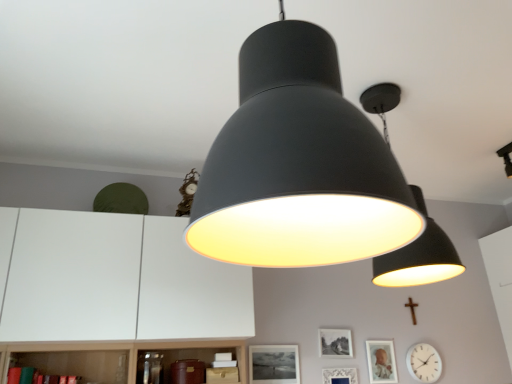
How much space does matte silver picture frame at lower right, the fourth picture frame positioned from the left, occupy vertically?

matte silver picture frame at lower right, the fourth picture frame positioned from the left, is 10.72 inches tall.

Describe the element at coordinates (381, 361) in the screenshot. I see `matte silver picture frame at lower right, the fourth picture frame positioned from the left` at that location.

This screenshot has width=512, height=384. Find the location of `matte black lampshade at center, which appears as the 2th lamp when viewed from the back`. matte black lampshade at center, which appears as the 2th lamp when viewed from the back is located at coordinates (298, 165).

What's the angular difference between matte black lampshade at center, the 1th lamp from the front, and black matte picture frame at center, which is the 4th picture frame from right to left,'s facing directions?

The angular difference between matte black lampshade at center, the 1th lamp from the front, and black matte picture frame at center, which is the 4th picture frame from right to left, is 1.17 degrees.

Is matte black lampshade at center, which appears as the 2th lamp when viewed from the back, facing towards black matte picture frame at center, which ranks as the 1th picture frame in left-to-right order?

No, matte black lampshade at center, which appears as the 2th lamp when viewed from the back, is not aimed at black matte picture frame at center, which ranks as the 1th picture frame in left-to-right order.

Can we say matte black lampshade at center, which appears as the 2th lamp when viewed from the back, lies outside black matte picture frame at center, which ranks as the 1th picture frame in left-to-right order?

Indeed, matte black lampshade at center, which appears as the 2th lamp when viewed from the back, is completely outside black matte picture frame at center, which ranks as the 1th picture frame in left-to-right order.

Is white glossy clock at lower right smaller than black matte picture frame at center, which is the 4th picture frame from right to left?

→ No, white glossy clock at lower right is not smaller than black matte picture frame at center, which is the 4th picture frame from right to left.

In the scene shown: Considering the sizes of white glossy clock at lower right and black matte picture frame at center, which is the 4th picture frame from right to left, in the image, is white glossy clock at lower right taller or shorter than black matte picture frame at center, which is the 4th picture frame from right to left,?

white glossy clock at lower right is taller than black matte picture frame at center, which is the 4th picture frame from right to left.

Is white glossy clock at lower right facing towards black matte picture frame at center, which is the 4th picture frame from right to left?

No, white glossy clock at lower right is not aimed at black matte picture frame at center, which is the 4th picture frame from right to left.

From the image's perspective, is white glossy clock at lower right over black matte picture frame at center, which ranks as the 1th picture frame in left-to-right order?

Actually, white glossy clock at lower right appears below black matte picture frame at center, which ranks as the 1th picture frame in left-to-right order, in the image.

Which of these two, matte silver picture frame at lower right, the fourth picture frame positioned from the left, or matte black lampshade at center, which ranks as the second lamp in right-to-left order, stands shorter?

matte silver picture frame at lower right, the fourth picture frame positioned from the left.

From the image's perspective, is matte silver picture frame at lower right, the 1th picture frame from the right, beneath matte black lampshade at center, which ranks as the second lamp in right-to-left order?

Correct, matte silver picture frame at lower right, the 1th picture frame from the right, appears lower than matte black lampshade at center, which ranks as the second lamp in right-to-left order, in the image.

Is matte silver picture frame at lower right, the fourth picture frame positioned from the left, situated inside matte black lampshade at center, which appears as the 2th lamp when viewed from the back, or outside?

matte silver picture frame at lower right, the fourth picture frame positioned from the left, is not inside matte black lampshade at center, which appears as the 2th lamp when viewed from the back, it's outside.

Would you consider matte silver picture frame at lower right, the 1th picture frame from the right, to be distant from matte black lampshade at center, the 1th lamp from the front?

matte silver picture frame at lower right, the 1th picture frame from the right, is positioned a significant distance from matte black lampshade at center, the 1th lamp from the front.

From a real-world perspective, starting from the white glossy clock at lower right, which lamp is the 1st one vertically above it? Please provide its 2D coordinates.

[(298, 165)]

Is white glossy clock at lower right positioned before matte black lampshade at center, which appears as the 2th lamp when viewed from the back?

That is False.

Considering the points (413, 365) and (374, 244), which point is behind, point (413, 365) or point (374, 244)?

The point (413, 365) is farther.

Between white glossy clock at lower right and matte black lampshade at center, which ranks as the second lamp in right-to-left order, which one has more height?

Standing taller between the two is matte black lampshade at center, which ranks as the second lamp in right-to-left order.

Between matte silver picture frame at lower right, the 1th picture frame from the right, and matte black picture frame at center, arranged as the 3th picture frame when viewed from the right, which one appears on the left side from the viewer's perspective?

matte black picture frame at center, arranged as the 3th picture frame when viewed from the right, is more to the left.

Is the position of matte silver picture frame at lower right, the fourth picture frame positioned from the left, more distant than that of matte black picture frame at center, the 2th picture frame from the left?

Yes, the depth of matte silver picture frame at lower right, the fourth picture frame positioned from the left, is greater than that of matte black picture frame at center, the 2th picture frame from the left.

Looking at the image, does matte silver picture frame at lower right, the fourth picture frame positioned from the left, seem bigger or smaller compared to matte black picture frame at center, the 2th picture frame from the left?

Clearly, matte silver picture frame at lower right, the fourth picture frame positioned from the left, is smaller in size than matte black picture frame at center, the 2th picture frame from the left.

Would you say matte silver picture frame at lower right, the 1th picture frame from the right, is outside matte black picture frame at center, arranged as the 3th picture frame when viewed from the right?

Yes, matte silver picture frame at lower right, the 1th picture frame from the right, is not within matte black picture frame at center, arranged as the 3th picture frame when viewed from the right.

Do you think matte black picture frame at center, arranged as the 3th picture frame when viewed from the right, is within white glossy clock at lower right, or outside of it?

matte black picture frame at center, arranged as the 3th picture frame when viewed from the right, cannot be found inside white glossy clock at lower right.

Which is in front, point (351, 353) or point (434, 378)?

The point (351, 353) is closer.

Does matte black picture frame at center, arranged as the 3th picture frame when viewed from the right, have a smaller size compared to white glossy clock at lower right?

Correct, matte black picture frame at center, arranged as the 3th picture frame when viewed from the right, occupies less space than white glossy clock at lower right.

At what (x,y) coordinates should I click in order to perform the action: click on the 2nd picture frame in front of the wooden cross at lower right. Please return your answer as a coordinate pair (x, y). The width and height of the screenshot is (512, 384). Looking at the image, I should click on (335, 343).

Is wooden cross at lower right oriented towards matte black picture frame at center, arranged as the 3th picture frame when viewed from the right?

No, wooden cross at lower right is not turned towards matte black picture frame at center, arranged as the 3th picture frame when viewed from the right.

Does wooden cross at lower right have a lesser height compared to matte black picture frame at center, arranged as the 3th picture frame when viewed from the right?

No, wooden cross at lower right is not shorter than matte black picture frame at center, arranged as the 3th picture frame when viewed from the right.

Which of these two, wooden cross at lower right or matte black picture frame at center, the 2th picture frame from the left, is bigger?

matte black picture frame at center, the 2th picture frame from the left.

At what (x,y) coordinates should I click in order to perform the action: click on the 2nd picture frame below the matte black lampshade at center, which ranks as the second lamp in right-to-left order (from the image's perspective). Please return your answer as a coordinate pair (x, y). Looking at the image, I should click on pos(274,364).

From a real-world perspective, count 2nd picture frames upward from the white glossy clock at lower right and point to it. Please provide its 2D coordinates.

[(274, 364)]

From the picture: Considering their positions, is matte black picture frame at center, the 2th picture frame from the left, positioned closer to black matte picture frame at center, which is the 4th picture frame from right to left, than wooden cross at lower right?

matte black picture frame at center, the 2th picture frame from the left, is positioned closer to the anchor black matte picture frame at center, which is the 4th picture frame from right to left.

When comparing their distances from black matte picture frame at center, which ranks as the 1th picture frame in left-to-right order, does matte black lampshade at center, the 1th lamp from the front, or white glossy clock at lower right seem further?

matte black lampshade at center, the 1th lamp from the front, is positioned further to the anchor black matte picture frame at center, which ranks as the 1th picture frame in left-to-right order.

When comparing their distances from matte black lampshade at upper center, which appears as the 2th lamp when viewed from the left, does white glossy clock at lower right or wooden cross at lower right seem closer?

white glossy clock at lower right is positioned closer to the anchor matte black lampshade at upper center, which appears as the 2th lamp when viewed from the left.

When comparing their distances from wooden cross at lower right, does white glossy clock at lower right or white matte dresser at lower left seem closer?

white glossy clock at lower right is positioned closer to the anchor wooden cross at lower right.

From the image, which object appears to be farther from white glossy clock at lower right, matte black lampshade at upper center, the 2th lamp viewed from the front, or matte black lampshade at center, which ranks as the second lamp in right-to-left order?

Based on the image, matte black lampshade at center, which ranks as the second lamp in right-to-left order, appears to be further to white glossy clock at lower right.

From the image, which object appears to be farther from matte black picture frame at center, the 2th picture frame from the left, matte silver picture frame at lower right, the fourth picture frame positioned from the left, or black matte picture frame at center, which ranks as the 1th picture frame in left-to-right order?

black matte picture frame at center, which ranks as the 1th picture frame in left-to-right order.

Looking at the image, which one is located closer to white glossy clock at lower right, matte white picture frame at center, the 3th picture frame viewed from the left, or matte black lampshade at center, which ranks as the second lamp in right-to-left order?

matte white picture frame at center, the 3th picture frame viewed from the left, lies closer to white glossy clock at lower right than the other object.

Which object lies nearer to the anchor point matte white picture frame at center, the 3th picture frame viewed from the left, black matte picture frame at center, which ranks as the 1th picture frame in left-to-right order, or wooden cross at lower right?

The object closer to matte white picture frame at center, the 3th picture frame viewed from the left, is black matte picture frame at center, which ranks as the 1th picture frame in left-to-right order.

You are a GUI agent. You are given a task and a screenshot of the screen. Output one action in this format:
    pyautogui.click(x=<x>, y=<y>)
    Task: Click on the picture frame situated between white matte dresser at lower left and matte black picture frame at center, the 2th picture frame from the left, from left to right
    The width and height of the screenshot is (512, 384).
    Given the screenshot: What is the action you would take?
    pyautogui.click(x=274, y=364)

Find the location of a particular element. This screenshot has width=512, height=384. picture frame between matte black lampshade at upper center, the 2th lamp viewed from the front, and black matte picture frame at center, which is the 4th picture frame from right to left, vertically is located at coordinates click(x=335, y=343).

Where is `crucifix situated between matte black picture frame at center, the 2th picture frame from the left, and white glossy clock at lower right from left to right`? This screenshot has height=384, width=512. crucifix situated between matte black picture frame at center, the 2th picture frame from the left, and white glossy clock at lower right from left to right is located at coordinates (412, 309).

This screenshot has width=512, height=384. Find the location of `picture frame between matte black picture frame at center, the 2th picture frame from the left, and matte silver picture frame at lower right, the fourth picture frame positioned from the left, in the horizontal direction`. picture frame between matte black picture frame at center, the 2th picture frame from the left, and matte silver picture frame at lower right, the fourth picture frame positioned from the left, in the horizontal direction is located at coordinates (339, 376).